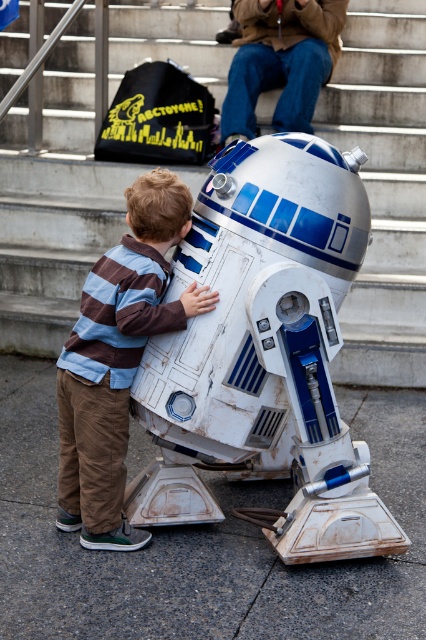
The width and height of the screenshot is (426, 640). What are the coordinates of `white matte robot at center` in the screenshot? It's located at (383, 186).

This screenshot has width=426, height=640. What do you see at coordinates (383, 186) in the screenshot? I see `white matte robot at center` at bounding box center [383, 186].

Identify the location of white matte robot at center. Image resolution: width=426 pixels, height=640 pixels. pyautogui.click(x=383, y=186).